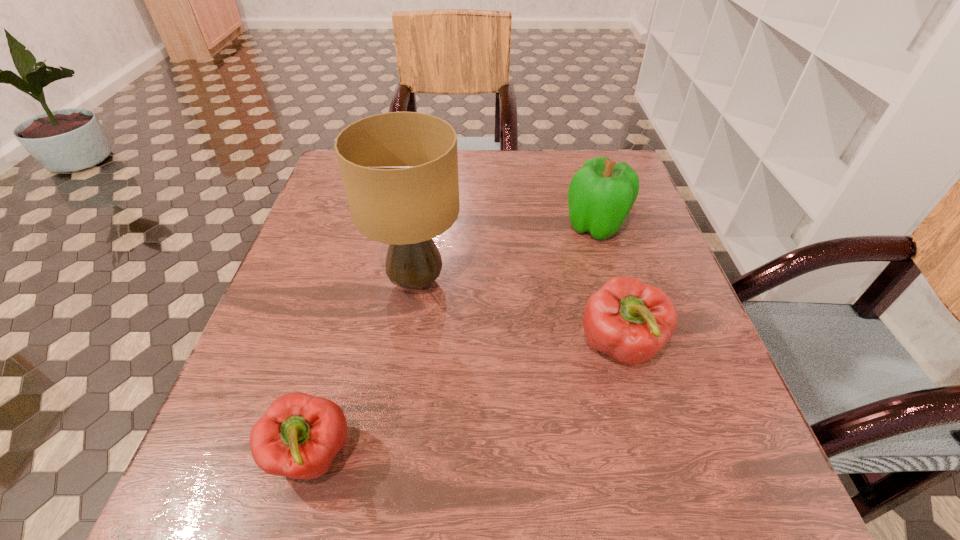
The image size is (960, 540). Find the location of `the tallest object`. the tallest object is located at coordinates (400, 169).

Locate an element on the screen. The width and height of the screenshot is (960, 540). the farthest object is located at coordinates (601, 194).

At what (x,y) coordinates should I click in order to perform the action: click on the tallest bell pepper. Please return your answer as a coordinate pair (x, y). This screenshot has height=540, width=960. Looking at the image, I should click on (601, 194).

Identify the location of the second nearest bell pepper. This screenshot has height=540, width=960. (630, 321).

You are a GUI agent. You are given a task and a screenshot of the screen. Output one action in this format:
    pyautogui.click(x=<x>, y=<y>)
    Task: Click on the second shortest bell pepper
    
    Given the screenshot: What is the action you would take?
    pyautogui.click(x=630, y=321)

Where is `the shortest bell pepper`? the shortest bell pepper is located at coordinates (299, 435).

The image size is (960, 540). In order to click on the nearest bell pepper in this screenshot , I will do `click(299, 435)`.

At what (x,y) coordinates should I click in order to perform the action: click on free space located 0.050m on the front of the tallest object. Please return your answer as a coordinate pair (x, y). The image size is (960, 540). Looking at the image, I should click on (408, 338).

The height and width of the screenshot is (540, 960). In order to click on vacant space located on the front of the farthest object in this screenshot , I will do `click(630, 340)`.

This screenshot has height=540, width=960. What are the coordinates of `free point located 0.300m on the back of the second shortest bell pepper` in the screenshot? It's located at (585, 219).